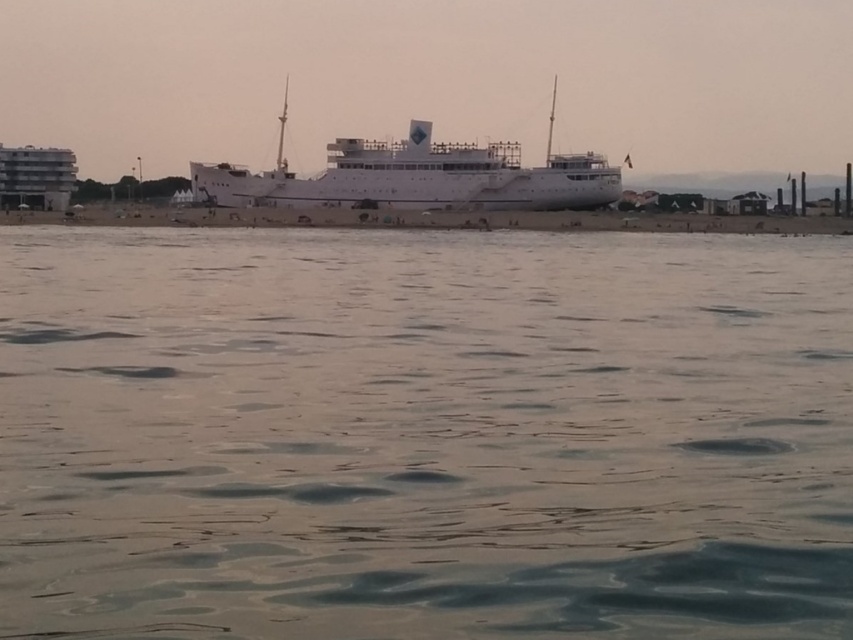
Question: Does clear water at center have a larger size compared to white glossy ship at center?

Choices:
 (A) no
 (B) yes

Answer: (A)

Question: Which point is farther to the camera?

Choices:
 (A) (424, 128)
 (B) (622, 540)

Answer: (A)

Question: Where is clear water at center located in relation to white glossy ship at center in the image?

Choices:
 (A) above
 (B) below

Answer: (B)

Question: Is clear water at center to the left of white glossy ship at center from the viewer's perspective?

Choices:
 (A) yes
 (B) no

Answer: (B)